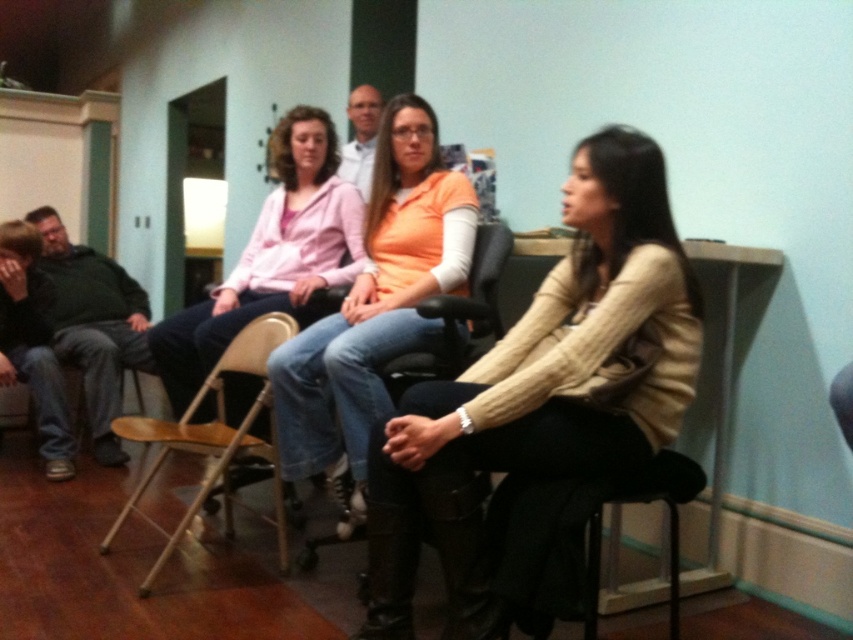
You are sitting in a meeting room with two people wearing the matte orange sweater at center and the white matte shirt at center. If you want to pass a note to the person on the left, which of the two should you hand it to first?

The white matte shirt at center is on the left side compared to the matte orange sweater at center, so you should hand the note to the white matte shirt at center first.